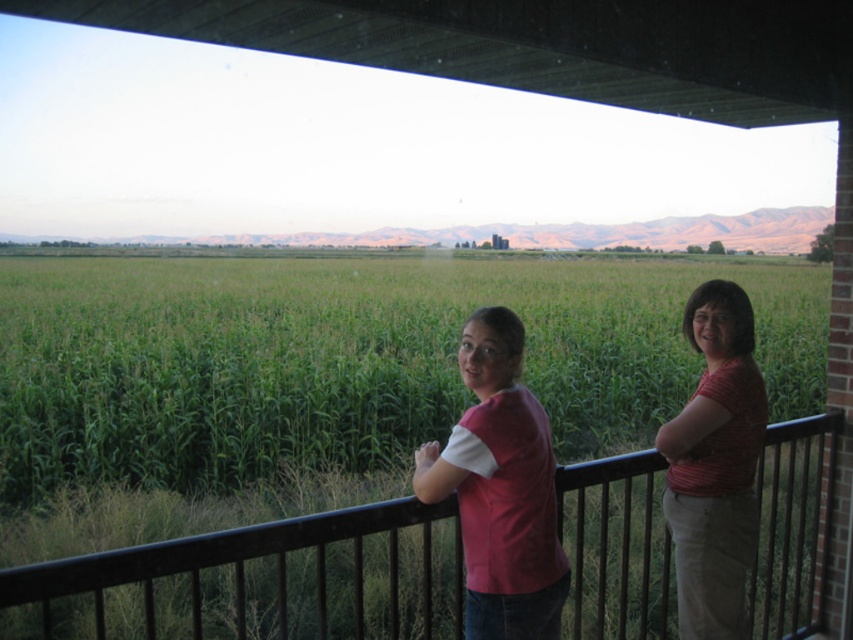
You are standing on the balcony and want to take a photo of both the matte pink shirt at right and the green grassy corn field at center. Can you frame both in the same shot without moving your camera?

The matte pink shirt at right is behind the green grassy corn field at center, so they are at different depths. You can frame both in the same shot by ensuring the matte pink shirt at right is positioned in the foreground or background appropriately, but since they are spatially separated, you might need to adjust your camera angle to include both.